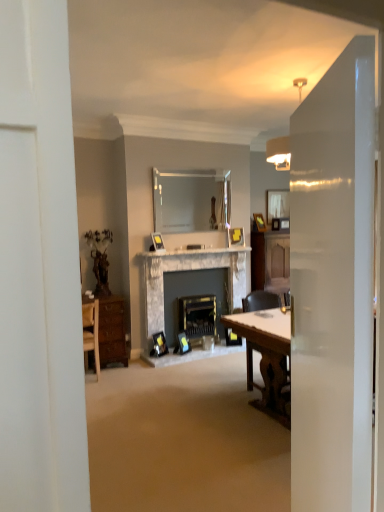
Question: Is transparent glass door at right placed right next to matte black fireplace at center, which is counted as the 1th fireplace, starting from the right?

Choices:
 (A) no
 (B) yes

Answer: (A)

Question: From the image's perspective, is transparent glass door at right beneath matte black fireplace at center, which is counted as the 1th fireplace, starting from the right?

Choices:
 (A) yes
 (B) no

Answer: (B)

Question: Is transparent glass door at right wider than matte black fireplace at center, which is counted as the 1th fireplace, starting from the right?

Choices:
 (A) no
 (B) yes

Answer: (B)

Question: From a real-world perspective, does transparent glass door at right stand above matte black fireplace at center, which is counted as the 1th fireplace, starting from the right?

Choices:
 (A) yes
 (B) no

Answer: (A)

Question: Is transparent glass door at right to the right of matte black fireplace at center, which is counted as the 1th fireplace, starting from the right, from the viewer's perspective?

Choices:
 (A) no
 (B) yes

Answer: (B)

Question: From the image's perspective, is transparent glass door at right on top of matte black fireplace at center, acting as the 2th fireplace starting from the left?

Choices:
 (A) yes
 (B) no

Answer: (A)

Question: From the image's perspective, is matte silver picture frame at center, which is the second picture frame from front to back, on white marble fireplace at center?

Choices:
 (A) yes
 (B) no

Answer: (A)

Question: Is matte silver picture frame at center, the first picture frame in the left-to-right sequence, aimed at white marble fireplace at center?

Choices:
 (A) yes
 (B) no

Answer: (B)

Question: Can you confirm if matte silver picture frame at center, the fourth picture frame positioned from the back, is positioned to the left of white marble fireplace at center?

Choices:
 (A) yes
 (B) no

Answer: (A)

Question: Is matte silver picture frame at center, which ranks as the fifth picture frame in right-to-left order, oriented away from white marble fireplace at center?

Choices:
 (A) no
 (B) yes

Answer: (A)

Question: From a real-world perspective, does matte silver picture frame at center, the 3th picture frame from the bottom, sit lower than white marble fireplace at center?

Choices:
 (A) no
 (B) yes

Answer: (A)

Question: Can you confirm if matte silver picture frame at center, which ranks as the fifth picture frame in right-to-left order, is bigger than white marble fireplace at center?

Choices:
 (A) no
 (B) yes

Answer: (A)

Question: Does matte silver picture frame at center, which is the second picture frame from front to back, have a lesser width compared to clear glass mirror at upper center, which appears as the first mirror when viewed from the left?

Choices:
 (A) no
 (B) yes

Answer: (A)